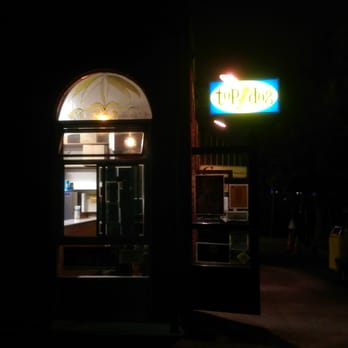
Locate an element on the screen. over head window is located at coordinates (123, 100).